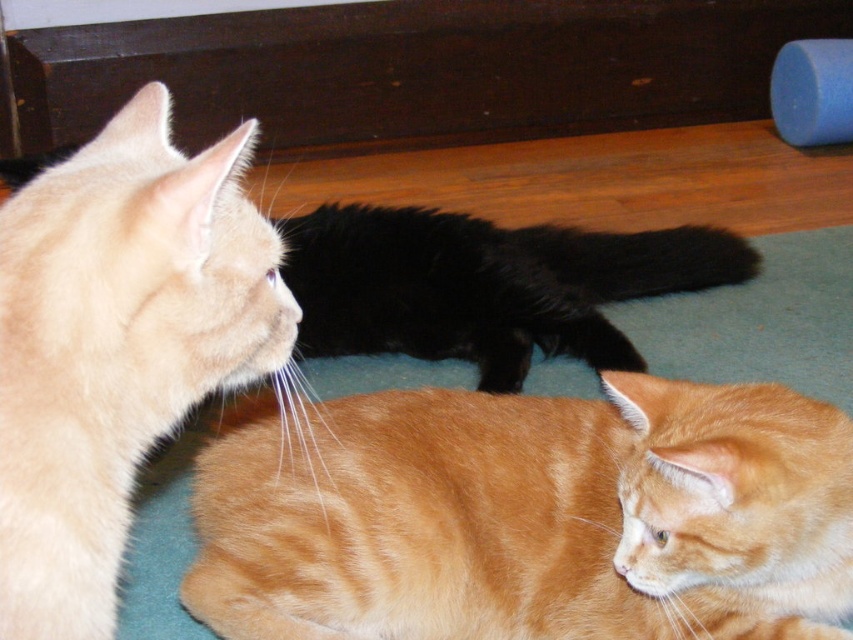
Based on the photo, you are a photographer trying to capture all the cats in a single frame. Given that the orange fur cat at lower center is smaller in size compared to the black fluffy cat at center, which cat would you need to position closer to the camera to ensure both appear equally sized in the photo?

To make both the orange fur cat at lower center and the black fluffy cat at center appear equally sized in the photo, you should position the orange fur cat at lower center closer to the camera since it is smaller in size.

You are a photographer trying to capture a photo of both the orange fur cat at lower center and the black fluffy cat at center. Since you want both cats to be in focus, you need to adjust your camera to focus on a specific point. Based on their positions, which cat should you focus on to ensure both are in focus?

You should focus on the orange fur cat at lower center because it is located below the black fluffy cat at center, so focusing on the closer cat will help keep both in focus.

You are a cat owner trying to buy a new pet bed for your cats. The bed you want to buy is designed to fit cats with a minimum width of 30 cm. Based on the image, can both the orange fur cat at lower center and the black fluffy cat at center fit into the bed?

The orange fur cat at lower center has a width less than the black fluffy cat at center. Since the bed requires a minimum width of 30 cm, we need to know the exact width of the black fluffy cat at center to determine if both can fit. However, the information provided only states the relative size between them, not their actual measurements. Therefore, it is uncertain if they can both fit without additional data.